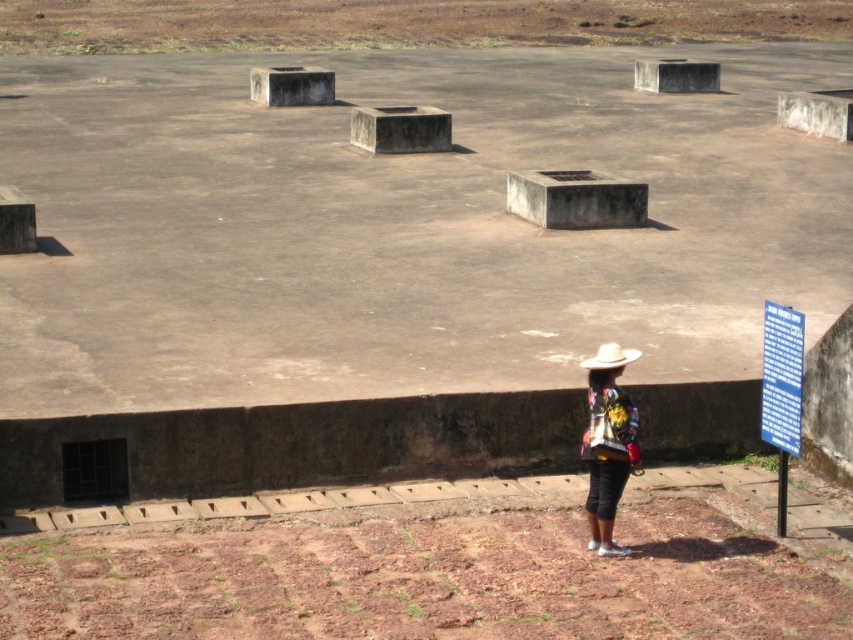
Question: Which point is farther to the camera?

Choices:
 (A) (624, 349)
 (B) (602, 444)

Answer: (A)

Question: Among these points, which one is nearest to the camera?

Choices:
 (A) (621, 416)
 (B) (608, 355)
 (C) (445, 28)

Answer: (B)

Question: Which of these objects is positioned farthest from the floral fabric jacket at lower right?

Choices:
 (A) white matte cowboy hat at lower right
 (B) brown dirt field at upper center

Answer: (B)

Question: Does brown dirt field at upper center appear on the left side of floral fabric jacket at lower right?

Choices:
 (A) yes
 (B) no

Answer: (A)

Question: Is brown dirt field at upper center to the left of floral fabric jacket at lower right from the viewer's perspective?

Choices:
 (A) no
 (B) yes

Answer: (B)

Question: Is floral fabric jacket at lower right bigger than white matte cowboy hat at lower right?

Choices:
 (A) yes
 (B) no

Answer: (B)